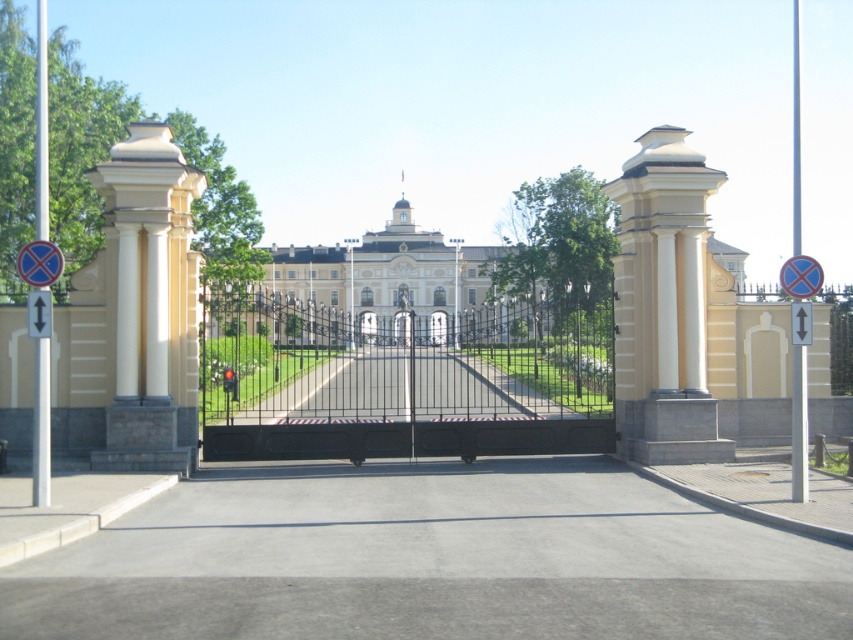
You are a security guard at the entrance of the building. You need to check if the black wrought iron gate at center and the black metal gate at center are aligned properly. According to the scene description, which gate is positioned to the left of the other?

The black wrought iron gate at center is positioned on the left side of black metal gate at center.

You are a delivery driver who needs to enter through the entrance shown in the image. The entrance has a black wrought iron gate at center and a white plastic arrow at center. Which object would you need to pass through to enter the building?

The black wrought iron gate at center is the entrance barrier, so you would need to pass through the black wrought iron gate at center to enter the building.

You are standing at the entrance of the building and want to locate the black wrought iron gate at center. According to the coordinates provided, where exactly would you find it?

The black wrought iron gate at center is located at coordinates point (403, 362).